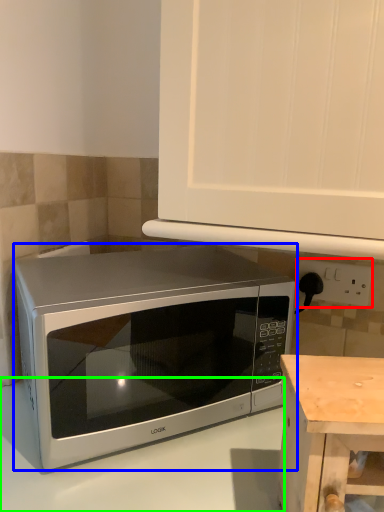
Question: Based on their relative distances, which object is nearer to electric outlet (highlighted by a red box)? Choose from microwave oven (highlighted by a blue box) and counter top (highlighted by a green box).

Choices:
 (A) microwave oven
 (B) counter top

Answer: (A)